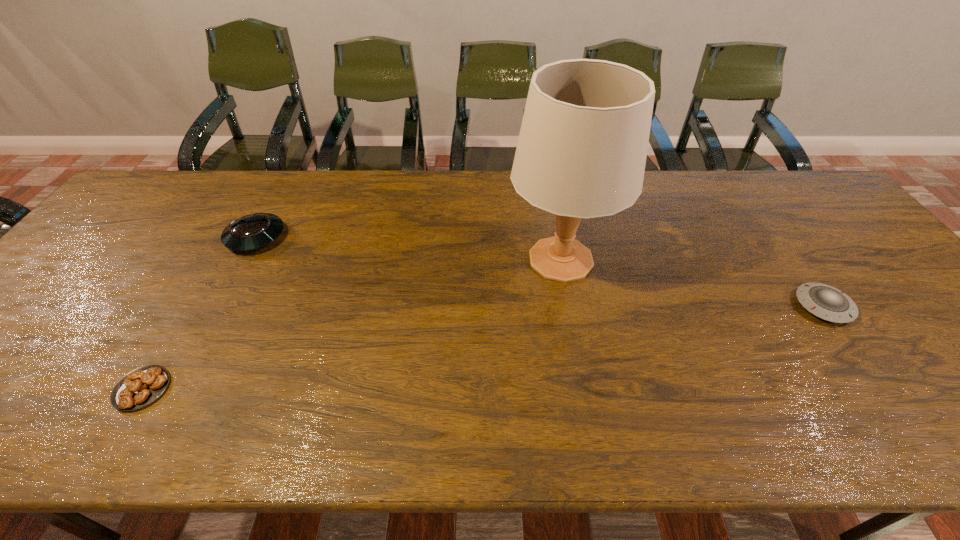
Where is `free space located on the back of the rightmost object`? This screenshot has height=540, width=960. free space located on the back of the rightmost object is located at coordinates pos(752,205).

Locate an element on the screen. free spot located on the back of the pastry is located at coordinates (222, 255).

This screenshot has width=960, height=540. Identify the location of object that is at the near edge. [x=140, y=387].

Identify the location of vacant space at the far edge of the desktop. The height and width of the screenshot is (540, 960). (433, 180).

Where is `vacant space at the near edge`? This screenshot has height=540, width=960. vacant space at the near edge is located at coordinates tap(722, 411).

Image resolution: width=960 pixels, height=540 pixels. What are the coordinates of `vacant space at the left edge of the desktop` in the screenshot? It's located at (28, 320).

The height and width of the screenshot is (540, 960). Identify the location of free area in between the nearer saucer and the table lamp. (692, 283).

Locate an element on the screen. free spot between the shortest object and the nearer saucer is located at coordinates (483, 347).

Identify the location of vacant space that's between the second object from right to left and the left saucer. This screenshot has height=540, width=960. (408, 248).

Locate an element on the screen. vacant space that's between the tallest object and the shortest object is located at coordinates (351, 324).